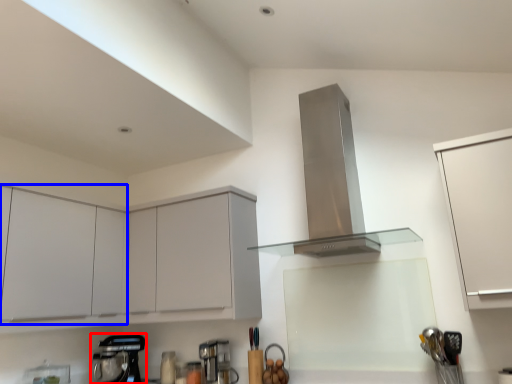
Question: Among these objects, which one is farthest to the camera, kitchen appliance (highlighted by a red box) or cabinetry (highlighted by a blue box)?

Choices:
 (A) kitchen appliance
 (B) cabinetry

Answer: (A)